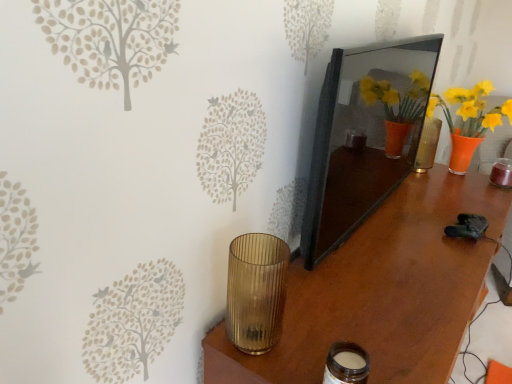
Identify the location of matte glass jar at lower center, acting as the first candle holder starting from the right. The image size is (512, 384). (346, 364).

Image resolution: width=512 pixels, height=384 pixels. In order to click on gold ribbed glass at lower left, placed as the 2th candle holder when sorted from right to left in this screenshot , I will do `click(256, 291)`.

Measure the distance between point (277, 338) and camera.

They are 35.24 inches apart.

Locate an element on the screen. Image resolution: width=512 pixels, height=384 pixels. matte black mirror at center is located at coordinates (365, 135).

What do you see at coordinates (365, 135) in the screenshot? The height and width of the screenshot is (384, 512). I see `matte black mirror at center` at bounding box center [365, 135].

The image size is (512, 384). I want to click on matte glass jar at lower center, which appears as the second candle holder when viewed from the left, so click(x=346, y=364).

Which is behind, matte black mirror at center or gold ribbed glass at lower left, which appears as the 1th candle holder when viewed from the left?

matte black mirror at center is behind.

How many degrees apart are the facing directions of matte black mirror at center and gold ribbed glass at lower left, which appears as the 1th candle holder when viewed from the left?

They differ by 2.79 degrees in their facing directions.

Can gold ribbed glass at lower left, placed as the 2th candle holder when sorted from right to left, be found inside matte black mirror at center?

No.

Is matte black mirror at center beside gold ribbed glass at lower left, placed as the 2th candle holder when sorted from right to left?

No.

Between matte glass jar at lower center, which appears as the second candle holder when viewed from the left, and gold ribbed glass at lower left, which appears as the 1th candle holder when viewed from the left, which one has smaller width?

matte glass jar at lower center, which appears as the second candle holder when viewed from the left.

Identify the location of candle holder behind the matte glass jar at lower center, which appears as the second candle holder when viewed from the left. (256, 291).

Is gold ribbed glass at lower left, which appears as the 1th candle holder when viewed from the left, completely or partially inside matte glass jar at lower center, which appears as the second candle holder when viewed from the left?

No, gold ribbed glass at lower left, which appears as the 1th candle holder when viewed from the left, is not surrounded by matte glass jar at lower center, which appears as the second candle holder when viewed from the left.

From the image's perspective, starting from the brown wood table at center, which candle holder is the 2nd one above? Please provide its 2D coordinates.

[(256, 291)]

Between point (248, 271) and point (237, 380), which one is positioned behind?

Point (248, 271)

Do you think gold ribbed glass at lower left, which appears as the 1th candle holder when viewed from the left, is within brown wood table at center, or outside of it?

gold ribbed glass at lower left, which appears as the 1th candle holder when viewed from the left, is located beyond the bounds of brown wood table at center.

Who is taller, brown wood table at center or matte black mirror at center?

With more height is brown wood table at center.

Would you consider brown wood table at center to be distant from matte black mirror at center?

They are positioned close to each other.

Does brown wood table at center appear on the right side of matte black mirror at center?

Indeed, brown wood table at center is positioned on the right side of matte black mirror at center.

Is brown wood table at center located outside matte black mirror at center?

Absolutely, brown wood table at center is external to matte black mirror at center.

Between matte black mirror at center and matte glass jar at lower center, acting as the first candle holder starting from the right, which one appears on the right side from the viewer's perspective?

From the viewer's perspective, matte black mirror at center appears more on the right side.

Consider the image. From the image's perspective, is matte black mirror at center above or below matte glass jar at lower center, which appears as the second candle holder when viewed from the left?

Based on their image positions, matte black mirror at center is located above matte glass jar at lower center, which appears as the second candle holder when viewed from the left.

Who is taller, matte black mirror at center or matte glass jar at lower center, acting as the first candle holder starting from the right?

Standing taller between the two is matte black mirror at center.

Is matte black mirror at center in contact with matte glass jar at lower center, acting as the first candle holder starting from the right?

No, matte black mirror at center is not next to matte glass jar at lower center, acting as the first candle holder starting from the right.

Does brown wood table at center have a greater width compared to gold ribbed glass at lower left, placed as the 2th candle holder when sorted from right to left?

Indeed, brown wood table at center has a greater width compared to gold ribbed glass at lower left, placed as the 2th candle holder when sorted from right to left.

From a real-world perspective, is brown wood table at center over gold ribbed glass at lower left, placed as the 2th candle holder when sorted from right to left?

Actually, brown wood table at center is physically below gold ribbed glass at lower left, placed as the 2th candle holder when sorted from right to left, in the real world.

Find the location of a particular element. This screenshot has height=384, width=512. the 2nd candle holder located above the brown wood table at center (from a real-world perspective) is located at coordinates (x=256, y=291).

In terms of height, does matte black mirror at center look taller or shorter compared to brown wood table at center?

Clearly, matte black mirror at center is shorter compared to brown wood table at center.

What's the angular difference between matte black mirror at center and brown wood table at center's facing directions?

They differ by 2.08 degrees in their facing directions.

From the picture: From the image's perspective, which one is positioned higher, matte black mirror at center or brown wood table at center?

matte black mirror at center is shown above in the image.

From a real-world perspective, is matte black mirror at center over brown wood table at center?

Yes, from a real-world perspective, matte black mirror at center is on top of brown wood table at center.

At what (x,y) coordinates should I click in order to perform the action: click on the 2nd candle holder counting from the left side of the matte black mirror at center. Please return your answer as a coordinate pair (x, y). The image size is (512, 384). Looking at the image, I should click on (256, 291).

This screenshot has height=384, width=512. I want to click on candle holder behind the matte glass jar at lower center, which appears as the second candle holder when viewed from the left, so click(x=256, y=291).

From the image, which object appears to be nearer to matte glass jar at lower center, which appears as the second candle holder when viewed from the left, gold ribbed glass at lower left, which appears as the 1th candle holder when viewed from the left, or matte black mirror at center?

gold ribbed glass at lower left, which appears as the 1th candle holder when viewed from the left, lies closer to matte glass jar at lower center, which appears as the second candle holder when viewed from the left, than the other object.

Based on their spatial positions, is brown wood table at center or gold ribbed glass at lower left, placed as the 2th candle holder when sorted from right to left, further from matte glass jar at lower center, which appears as the second candle holder when viewed from the left?

brown wood table at center.

When comparing their distances from gold ribbed glass at lower left, placed as the 2th candle holder when sorted from right to left, does matte glass jar at lower center, acting as the first candle holder starting from the right, or matte black mirror at center seem further?

matte black mirror at center is further to gold ribbed glass at lower left, placed as the 2th candle holder when sorted from right to left.

Estimate the real-world distances between objects in this image. Which object is further from gold ribbed glass at lower left, placed as the 2th candle holder when sorted from right to left, brown wood table at center or matte glass jar at lower center, which appears as the second candle holder when viewed from the left?

brown wood table at center is positioned further to the anchor gold ribbed glass at lower left, placed as the 2th candle holder when sorted from right to left.

Looking at the image, which one is located closer to matte black mirror at center, brown wood table at center or matte glass jar at lower center, which appears as the second candle holder when viewed from the left?

Among the two, brown wood table at center is located nearer to matte black mirror at center.

When comparing their distances from matte glass jar at lower center, which appears as the second candle holder when viewed from the left, does gold ribbed glass at lower left, placed as the 2th candle holder when sorted from right to left, or brown wood table at center seem closer?

The object closer to matte glass jar at lower center, which appears as the second candle holder when viewed from the left, is gold ribbed glass at lower left, placed as the 2th candle holder when sorted from right to left.

Looking at the image, which one is located closer to gold ribbed glass at lower left, which appears as the 1th candle holder when viewed from the left, brown wood table at center or matte black mirror at center?

brown wood table at center lies closer to gold ribbed glass at lower left, which appears as the 1th candle holder when viewed from the left, than the other object.

Considering their positions, is gold ribbed glass at lower left, which appears as the 1th candle holder when viewed from the left, positioned further to matte black mirror at center than brown wood table at center?

gold ribbed glass at lower left, which appears as the 1th candle holder when viewed from the left.

At what (x,y) coordinates should I click in order to perform the action: click on candle holder between gold ribbed glass at lower left, placed as the 2th candle holder when sorted from right to left, and brown wood table at center, in the horizontal direction. Please return your answer as a coordinate pair (x, y). The height and width of the screenshot is (384, 512). Looking at the image, I should click on (346, 364).

This screenshot has width=512, height=384. I want to click on candle holder between matte black mirror at center and matte glass jar at lower center, acting as the first candle holder starting from the right, in the up-down direction, so click(x=256, y=291).